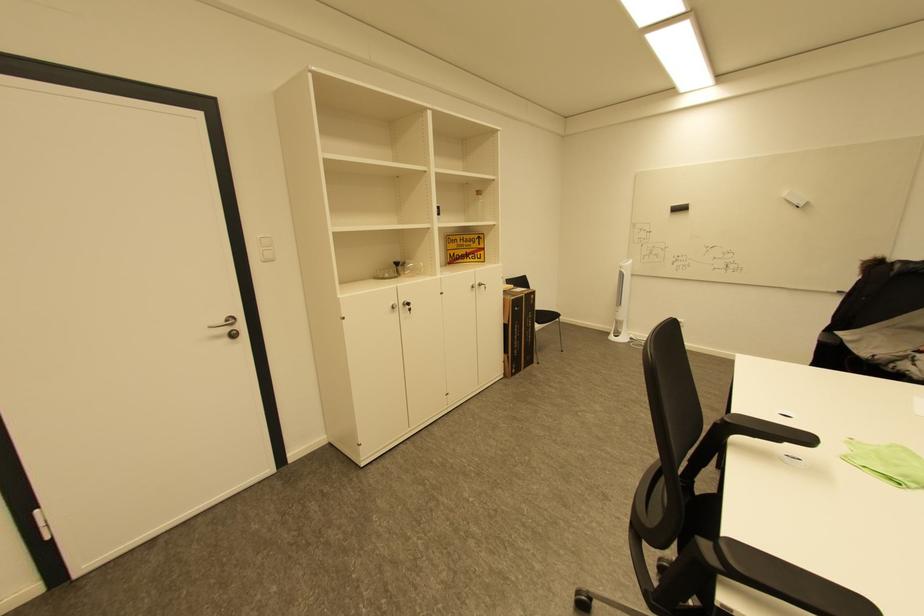
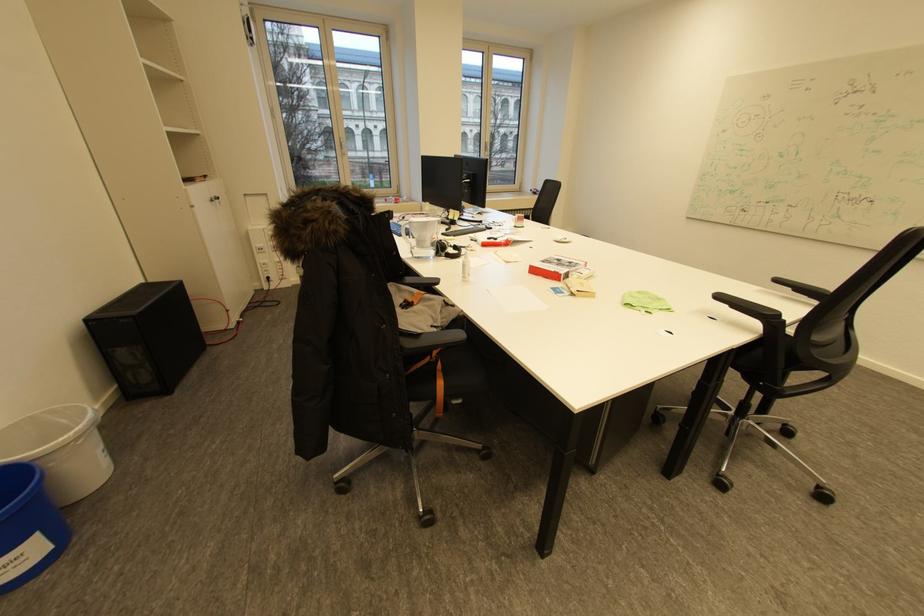
Find the pixel in the second image that matches (794,444) in the first image.

(737, 305)